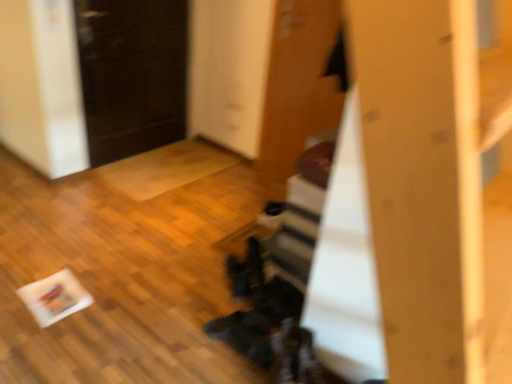
The image size is (512, 384). I want to click on free region under black glossy door at upper left, the 2th door in the right-to-left sequence (from a real-world perspective), so click(x=140, y=153).